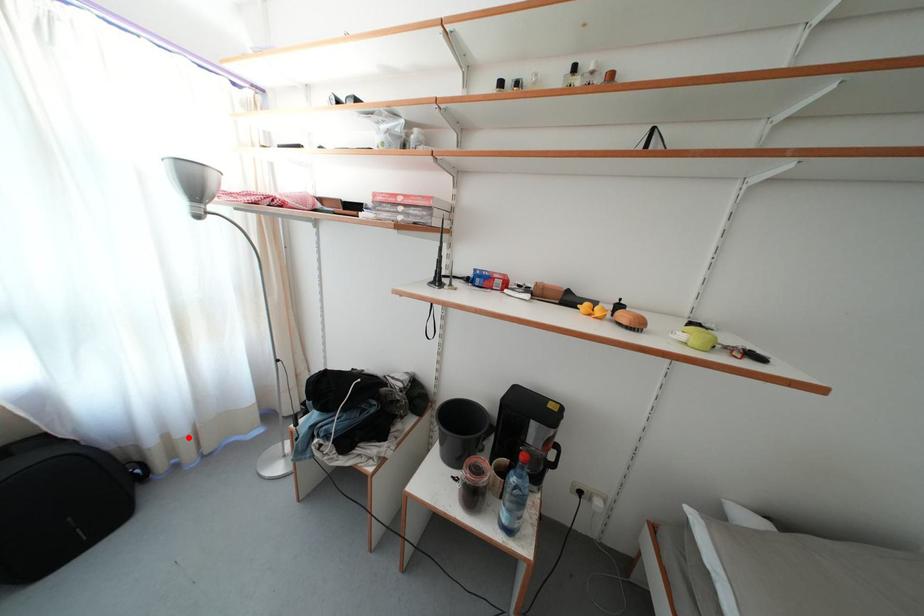
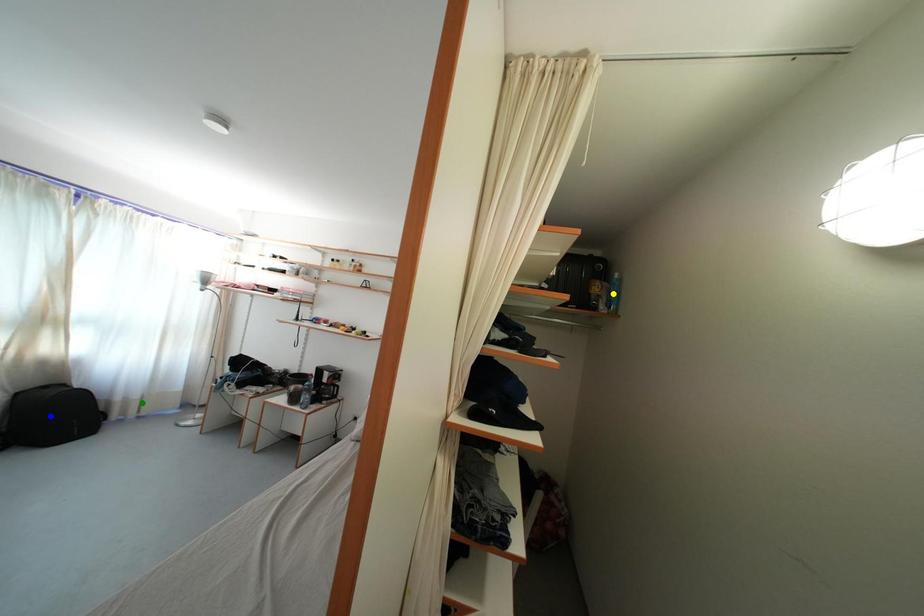
Question: I am providing you with two images of the same scene from different viewpoints. A red point is marked on the first image. You are given multiple points on the second image. Which mark in image 2 goes with the point in image 1?

Choices:
 (A) green point
 (B) yellow point
 (C) blue point

Answer: (A)